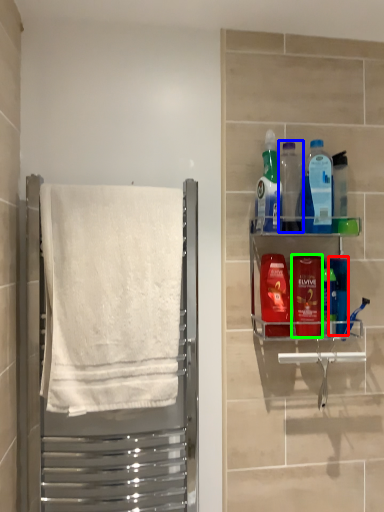
Question: Which object is the closest to the mouthwash (highlighted by a red box)? Choose among these: bottle (highlighted by a blue box) or mouthwash (highlighted by a green box).

Choices:
 (A) bottle
 (B) mouthwash

Answer: (B)